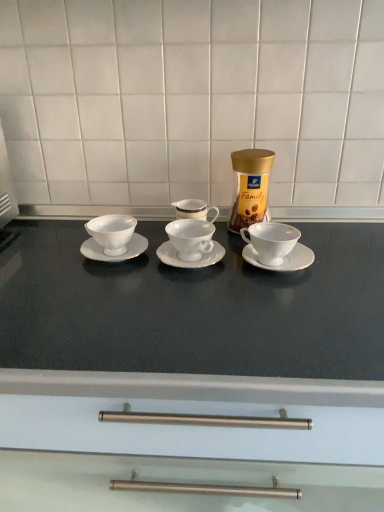
The image size is (384, 512). Find the location of `vacant area that lies to the right of white porcelain saucer at left, the third saucer from the right`. vacant area that lies to the right of white porcelain saucer at left, the third saucer from the right is located at coordinates (196, 263).